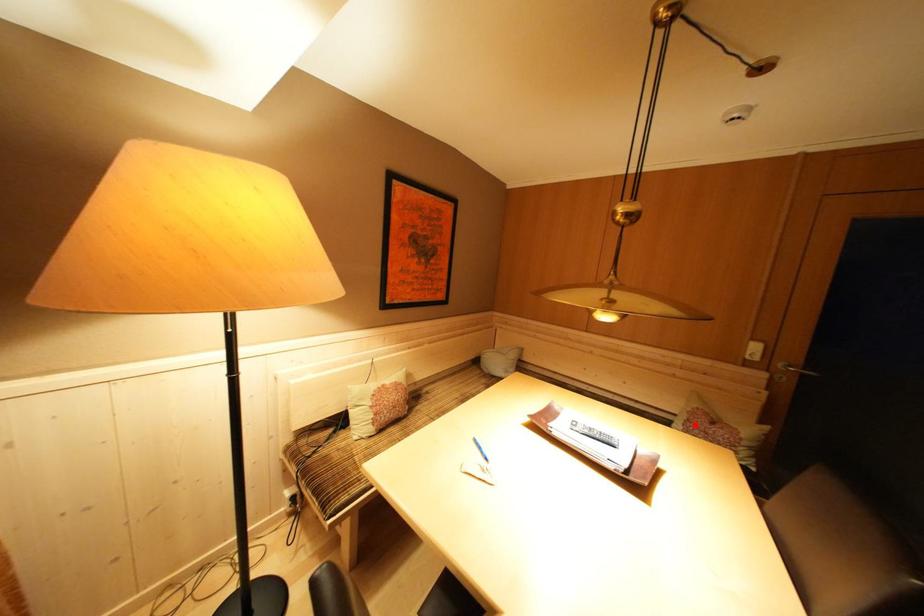
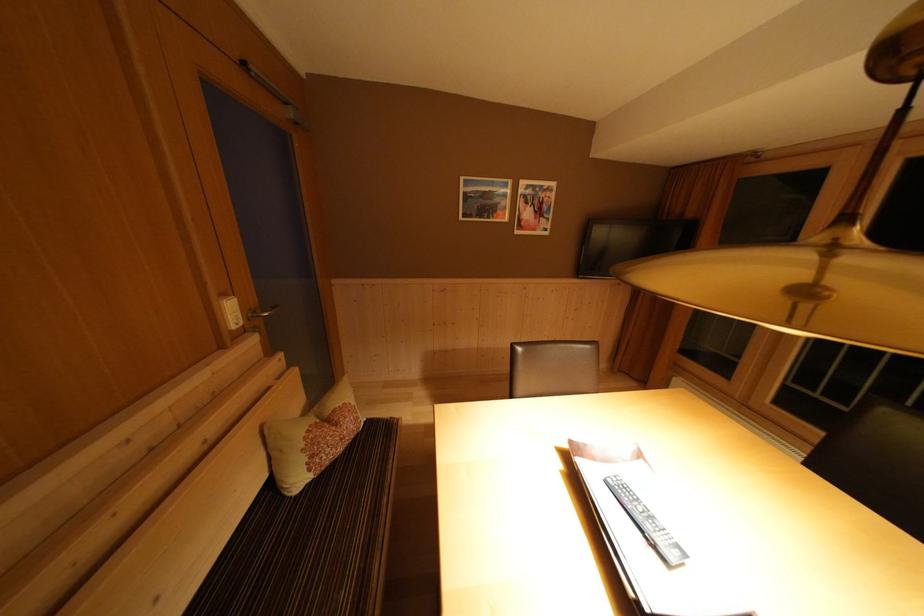
The point at the highlighted location is marked in the first image. Where is the corresponding point in the second image?

(319, 462)